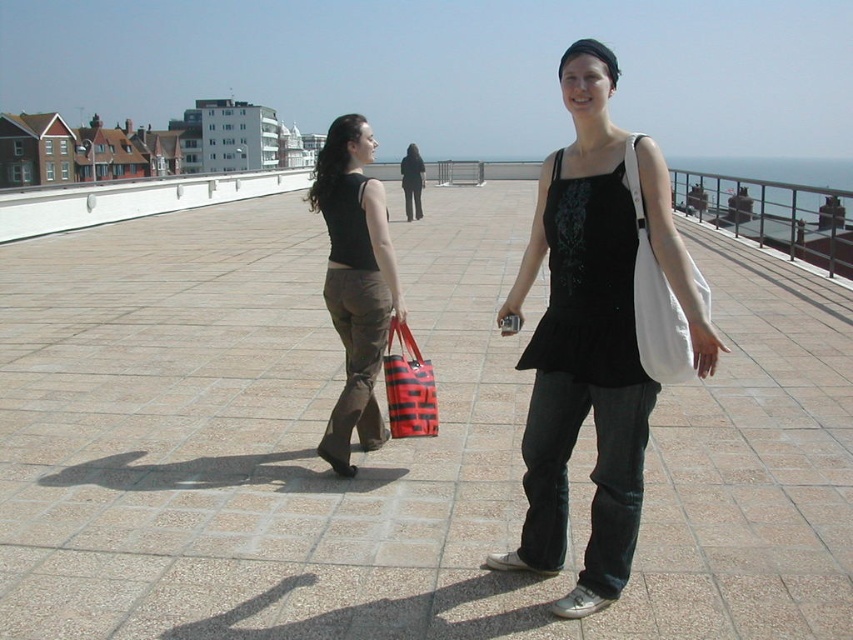
You are standing on the rooftop and want to place a small potted plant between the brown textured pavement at center and the matte black tank top at left. Which object should you place it closer to if you want the plant to be as close as possible to the viewer?

The brown textured pavement at center is closer to the viewer than the matte black tank top at left, so placing the plant near the brown textured pavement at center would make it closer to the viewer.

You are trying to decide which bag to take with you for a hike. Both the white fabric bag at center and the red striped fabric bag at center are available. Based on their sizes, which one might be more suitable for carrying more items?

The white fabric bag at center is much taller than the red striped fabric bag at center, so it might be more suitable for carrying more items due to its larger size.

You are planning to place a small potted plant on the rooftop. The brown textured pavement at center and the matte black tank top at left are both in your view. Which surface would be more appropriate for placing the plant, considering their sizes?

The brown textured pavement at center has a larger size compared to the matte black tank top at left, so it would be more appropriate to place the plant there as it provides a stable and sufficient space.